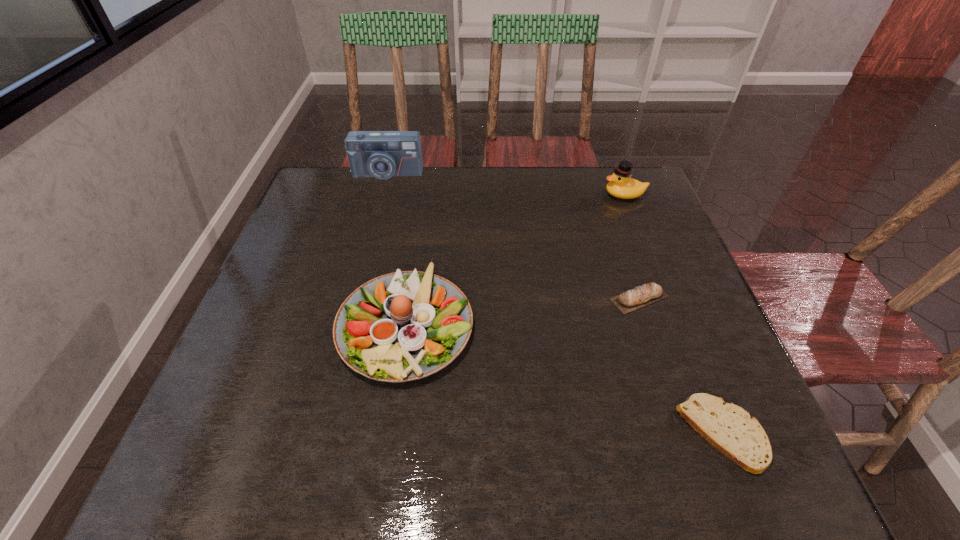
What are the coordinates of `free space located on the front-facing side of the duck` in the screenshot? It's located at point(487,195).

This screenshot has height=540, width=960. In order to click on free region located 0.280m on the front-facing side of the duck in this screenshot , I will do `click(507, 195)`.

Find the location of `vacant space situated 0.100m on the back of the salad plate`. vacant space situated 0.100m on the back of the salad plate is located at coordinates (418, 246).

What are the coordinates of `free space located on the back of the farther pita bread` in the screenshot? It's located at (625, 256).

Image resolution: width=960 pixels, height=540 pixels. In order to click on vacant position located 0.210m on the back of the shorter pita bread in this screenshot , I will do `click(674, 312)`.

This screenshot has height=540, width=960. What are the coordinates of `camera present at the far edge` in the screenshot? It's located at (381, 154).

Identify the location of duck that is positioned at the far edge. Image resolution: width=960 pixels, height=540 pixels. (621, 185).

You are a GUI agent. You are given a task and a screenshot of the screen. Output one action in this format:
    pyautogui.click(x=<x>, y=<y>)
    Task: Click on the object present at the near edge
    
    Given the screenshot: What is the action you would take?
    pyautogui.click(x=729, y=428)

You are a GUI agent. You are given a task and a screenshot of the screen. Output one action in this format:
    pyautogui.click(x=<x>, y=<y>)
    Task: Click on the object present at the left edge
    The height and width of the screenshot is (540, 960).
    Given the screenshot: What is the action you would take?
    pyautogui.click(x=381, y=154)

Locate an element on the screen. duck at the right edge is located at coordinates (621, 185).